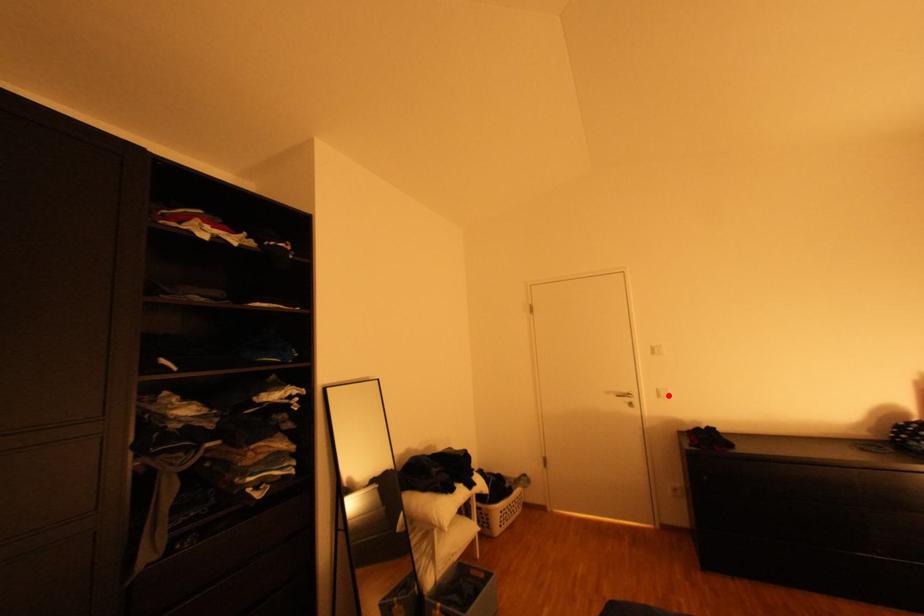
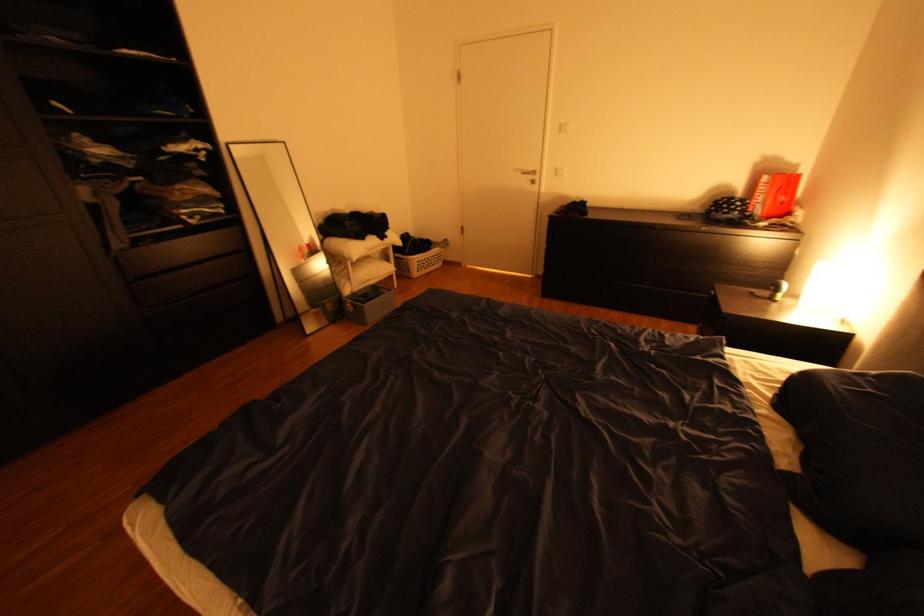
Question: I am providing you with two images of the same scene from different viewpoints. A red point is shown in image1. For the corresponding object point in image2, is it positioned nearer or farther from the camera?

Choices:
 (A) Nearer
 (B) Farther

Answer: (A)